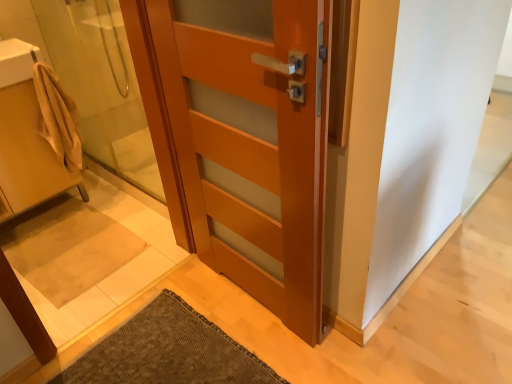
Find the location of a particular element. vacant area that is in front of matte wood door at center is located at coordinates (254, 346).